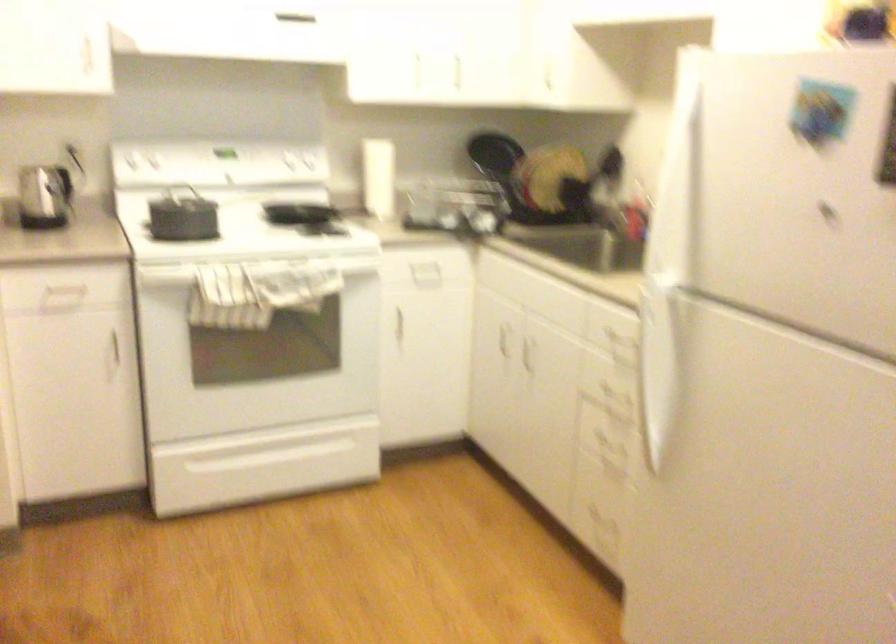
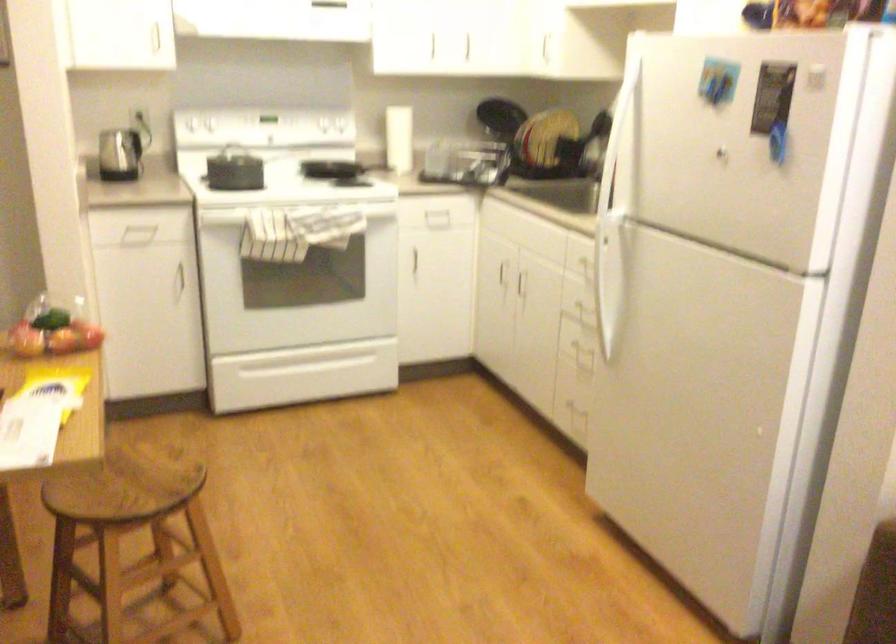
The point at (648, 377) is marked in the first image. Where is the corresponding point in the second image?

(607, 283)